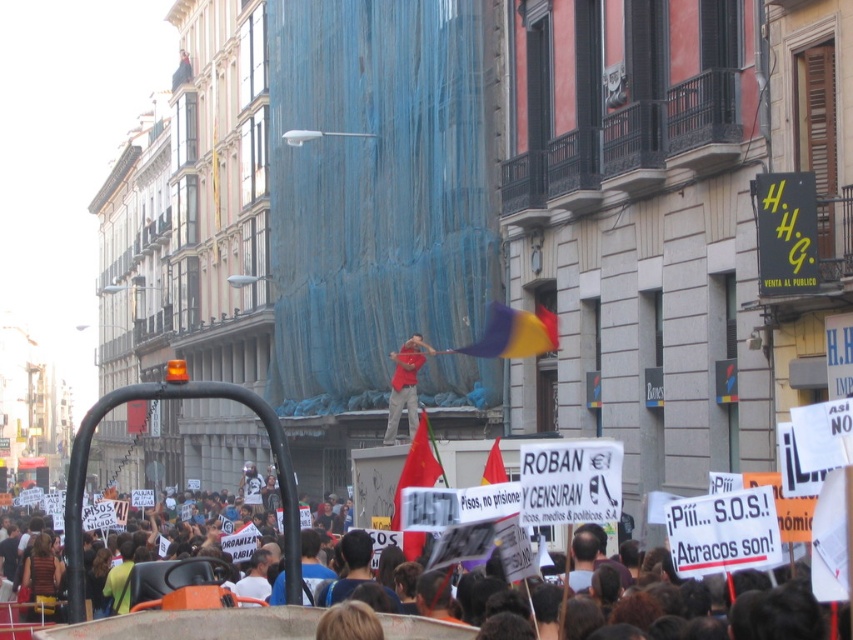
Can you confirm if red flag at center is wider than red cotton shirt at center?

Yes, red flag at center is wider than red cotton shirt at center.

Describe the element at coordinates (195, 625) in the screenshot. Image resolution: width=853 pixels, height=640 pixels. I see `red flag at center` at that location.

The image size is (853, 640). I want to click on red flag at center, so click(195, 625).

Who is positioned more to the left, polyester flag at center or red cotton shirt at center?

red cotton shirt at center is more to the left.

Is polyester flag at center to the left of red cotton shirt at center from the viewer's perspective?

No, polyester flag at center is not to the left of red cotton shirt at center.

Describe the element at coordinates (514, 333) in the screenshot. Image resolution: width=853 pixels, height=640 pixels. I see `polyester flag at center` at that location.

The image size is (853, 640). Find the location of `polyester flag at center`. polyester flag at center is located at coordinates (514, 333).

Does red flag at center appear on the right side of polyester flag at center?

No, red flag at center is not to the right of polyester flag at center.

The height and width of the screenshot is (640, 853). Find the location of `red flag at center`. red flag at center is located at coordinates (195, 625).

I want to click on red flag at center, so click(x=195, y=625).